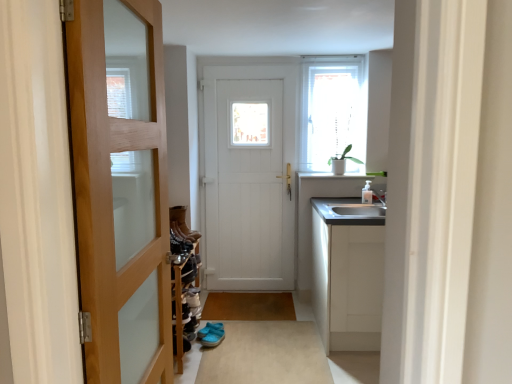
I want to click on vacant region in front of brown matte mat at center, the second plain ordered from the bottom, so click(x=262, y=329).